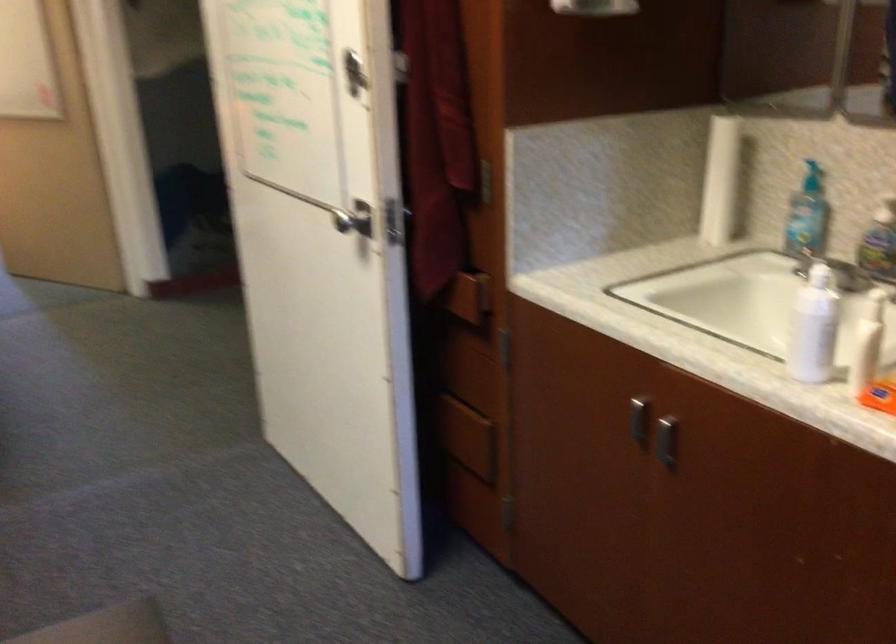
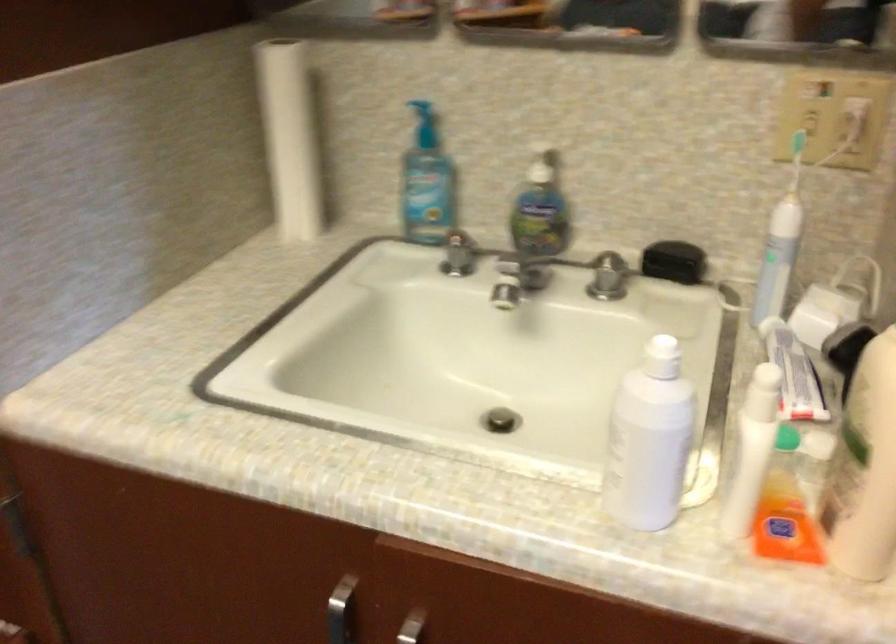
In the second image, find the point that corresponds to (812,272) in the first image.

(661, 357)